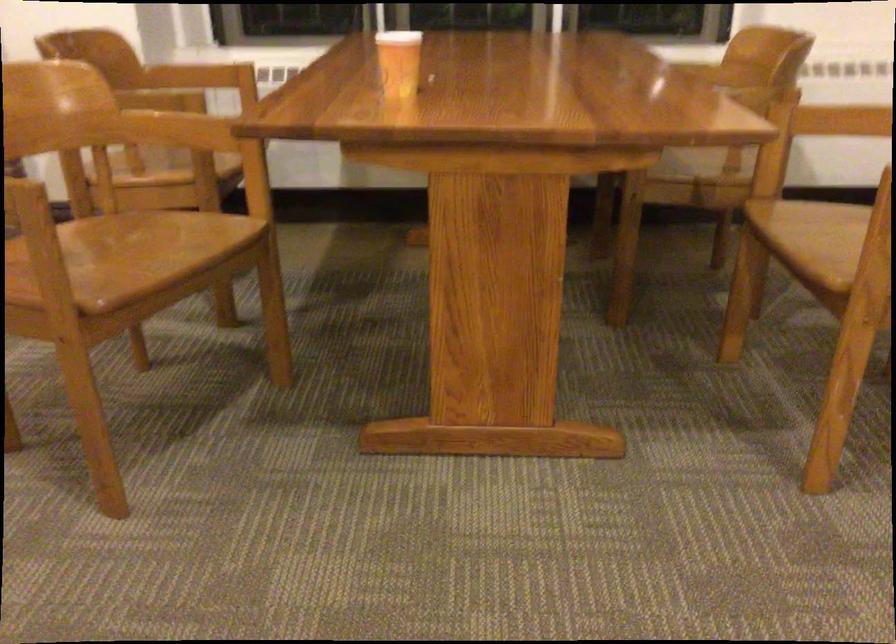
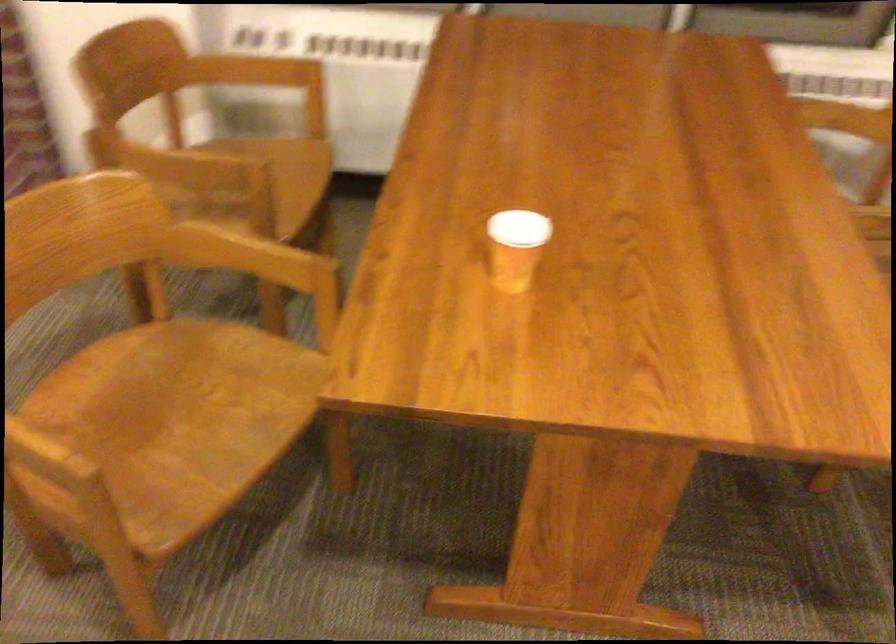
Locate, in the second image, the point that corresponds to the point at 118,104 in the first image.

(169, 163)